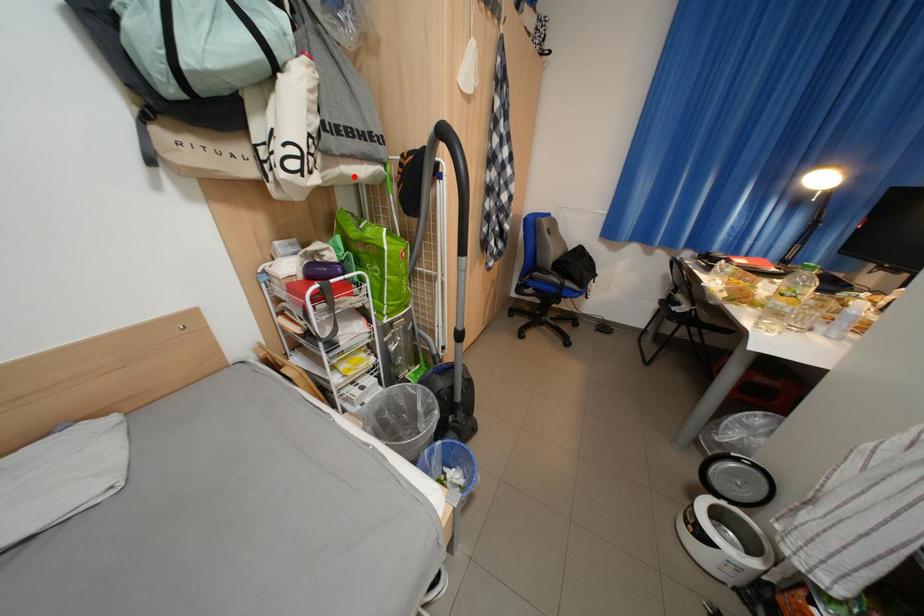
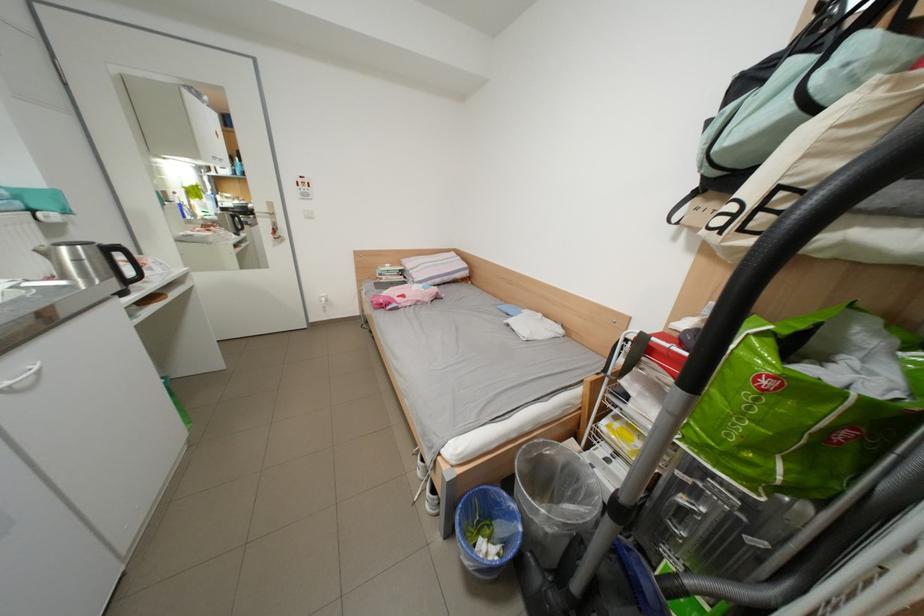
In the second image, find the point that corresponds to the highlighted location in the first image.

(856, 245)